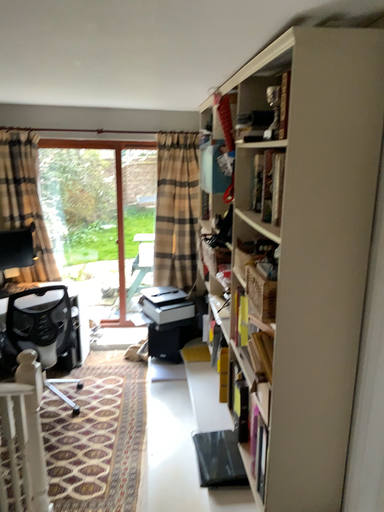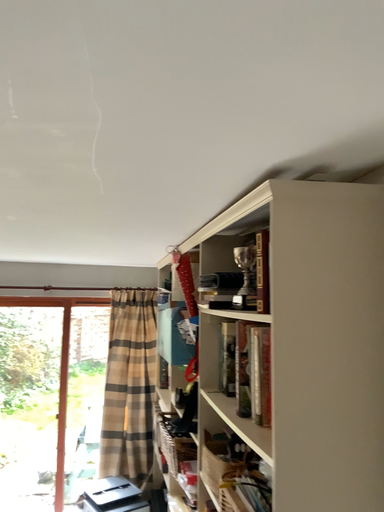
Question: How did the camera likely rotate when shooting the video?

Choices:
 (A) rotated upward
 (B) rotated downward

Answer: (A)